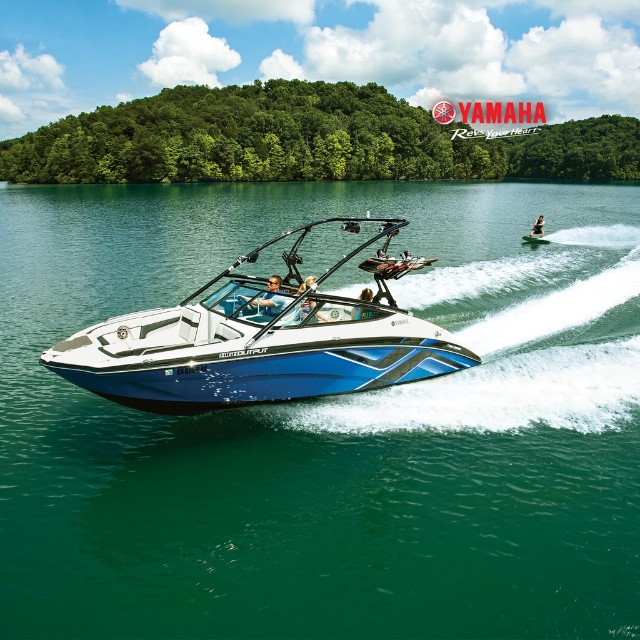
You are a photographer trying to capture the metallic blue helmet at center and the blue matte boat at center in a single shot. Since both are at the center, you need to adjust your camera angle to ensure both are visible. Which object will require you to zoom out more to include it in the frame?

The blue matte boat at center is thicker than the metallic blue helmet at center, so you will need to zoom out more to include the blue matte boat at center in the frame.

You are standing on the deck of the Yamaha high output motorboat and see two points marked on the boat. The first point is at coordinates point (528, 260) and the second point is at point (541, 234). Which point is closer to you?

Point (528, 260) is closer to the viewer than point (541, 234).

You are navigating a watercraft and need to position yourself directly behind the blue glossy wakeboard boat at center to follow it safely. Based on its current coordinates, what are the recommended coordinates for your position?

The blue glossy wakeboard boat at center is located at point [259,342]. To position yourself directly behind it, you should aim for coordinates slightly lower on the y and x axis, such as [252,339], ensuring a safe distance while maintaining visibility.